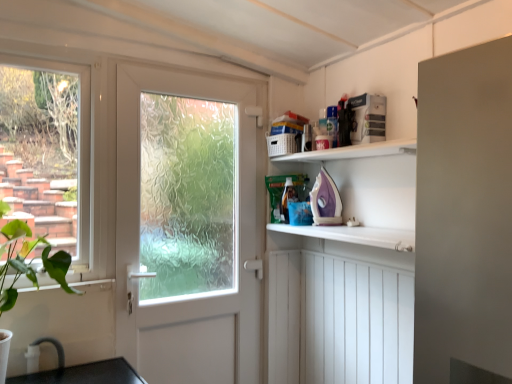
Question: Is white frosted glass door at center with green leafy plant at lower left?

Choices:
 (A) yes
 (B) no

Answer: (B)

Question: Considering the relative sizes of white frosted glass door at center and green leafy plant at lower left in the image provided, is white frosted glass door at center wider than green leafy plant at lower left?

Choices:
 (A) no
 (B) yes

Answer: (A)

Question: Would you say white frosted glass door at center contains green leafy plant at lower left?

Choices:
 (A) no
 (B) yes

Answer: (A)

Question: Is white frosted glass door at center facing away from green leafy plant at lower left?

Choices:
 (A) no
 (B) yes

Answer: (A)

Question: From the image's perspective, is white frosted glass door at center below green leafy plant at lower left?

Choices:
 (A) yes
 (B) no

Answer: (B)

Question: Is white frosted glass door at center at the right side of green leafy plant at lower left?

Choices:
 (A) no
 (B) yes

Answer: (B)

Question: From a real-world perspective, is green leafy plant at lower left below clear glass window at left?

Choices:
 (A) yes
 (B) no

Answer: (A)

Question: From the image's perspective, is green leafy plant at lower left beneath clear glass window at left?

Choices:
 (A) no
 (B) yes

Answer: (B)

Question: Does green leafy plant at lower left appear on the left side of clear glass window at left?

Choices:
 (A) no
 (B) yes

Answer: (A)

Question: Does green leafy plant at lower left have a greater width compared to clear glass window at left?

Choices:
 (A) no
 (B) yes

Answer: (B)

Question: Is green leafy plant at lower left closer to the viewer compared to clear glass window at left?

Choices:
 (A) no
 (B) yes

Answer: (B)

Question: From a real-world perspective, is green leafy plant at lower left on top of clear glass window at left?

Choices:
 (A) no
 (B) yes

Answer: (A)

Question: From a real-world perspective, is clear glass window at left beneath green leafy plant at lower left?

Choices:
 (A) no
 (B) yes

Answer: (A)